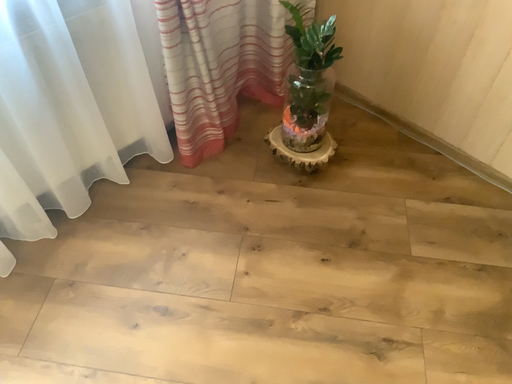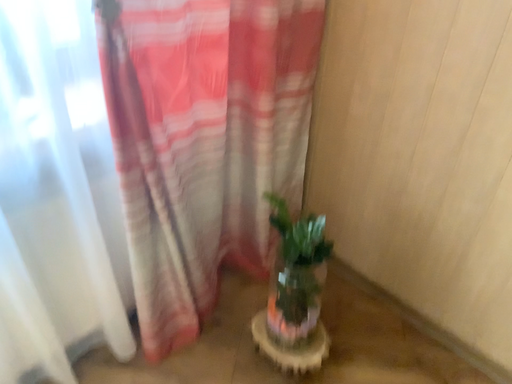
Question: Which way did the camera rotate in the video?

Choices:
 (A) rotated downward
 (B) rotated upward

Answer: (B)